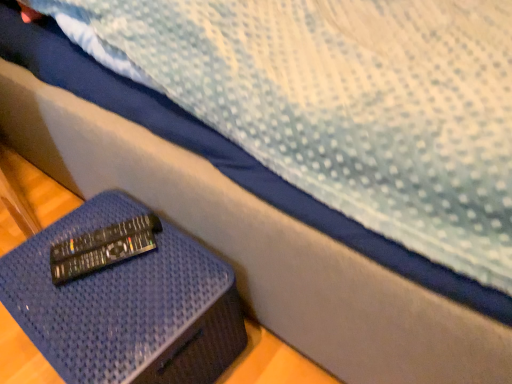
I want to click on vacant space behind black plastic remote at lower left, the second remote viewed from the back, so click(x=106, y=215).